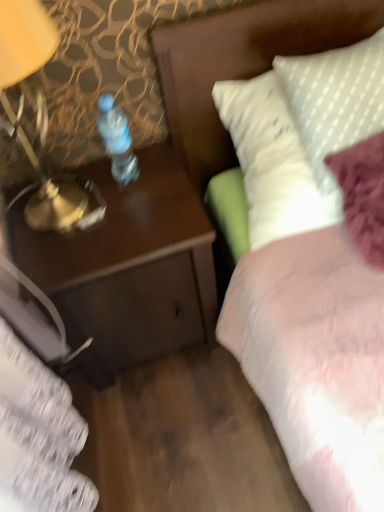
Where is `brown wood desk at left`? The image size is (384, 512). brown wood desk at left is located at coordinates (128, 267).

This screenshot has height=512, width=384. I want to click on white dotted pillow at upper right, so click(x=335, y=99).

This screenshot has width=384, height=512. What are the coordinates of `clear plastic bottle at center` in the screenshot? It's located at (117, 140).

This screenshot has height=512, width=384. I want to click on brown wood desk at left, so click(x=128, y=267).

Can you tell me how much white dotted pillow at upper right and clear plastic bottle at center differ in facing direction?

5.44 degrees.

Is point (364, 104) behind point (129, 175)?

No, (364, 104) is in front of (129, 175).

Can you confirm if white dotted pillow at upper right is shorter than clear plastic bottle at center?

Incorrect, the height of white dotted pillow at upper right does not fall short of that of clear plastic bottle at center.

Consider the image. Looking at their sizes, would you say white dotted pillow at upper right is wider or thinner than clear plastic bottle at center?

white dotted pillow at upper right is wider than clear plastic bottle at center.

Which object is more forward, clear plastic bottle at center or gold metallic lamp at left?

gold metallic lamp at left.

Can you confirm if clear plastic bottle at center is shorter than gold metallic lamp at left?

Correct, clear plastic bottle at center is not as tall as gold metallic lamp at left.

Is clear plastic bottle at center facing away from gold metallic lamp at left?

No, gold metallic lamp at left is not at the back of clear plastic bottle at center.

Can you confirm if clear plastic bottle at center is smaller than gold metallic lamp at left?

Indeed, clear plastic bottle at center has a smaller size compared to gold metallic lamp at left.

Based on the photo, from a real-world perspective, is white dotted fabric at upper right positioned under white dotted pillow at upper right based on gravity?

Yes, from a real-world perspective, white dotted fabric at upper right is beneath white dotted pillow at upper right.

In terms of size, does white dotted fabric at upper right appear bigger or smaller than white dotted pillow at upper right?

In the image, white dotted fabric at upper right appears to be larger than white dotted pillow at upper right.

Considering the sizes of objects white dotted fabric at upper right and white dotted pillow at upper right in the image provided, who is taller, white dotted fabric at upper right or white dotted pillow at upper right?

white dotted pillow at upper right is taller.

Which is correct: brown wood desk at left is inside clear plastic bottle at center, or outside of it?

The correct answer is: outside.

How different are the orientations of brown wood desk at left and clear plastic bottle at center in degrees?

The angle between the facing direction of brown wood desk at left and the facing direction of clear plastic bottle at center is 1.13 degrees.

Who is more distant, brown wood desk at left or clear plastic bottle at center?

Positioned behind is brown wood desk at left.

Considering the sizes of objects brown wood desk at left and clear plastic bottle at center in the image provided, who is bigger, brown wood desk at left or clear plastic bottle at center?

brown wood desk at left is bigger.

In the scene shown: How different are the orientations of gold metallic lamp at left and white dotted fabric at upper right in degrees?

gold metallic lamp at left and white dotted fabric at upper right are facing 1.82 degrees away from each other.

Is gold metallic lamp at left situated inside white dotted fabric at upper right or outside?

gold metallic lamp at left is not enclosed by white dotted fabric at upper right.

Which object is positioned more to the left, gold metallic lamp at left or white dotted fabric at upper right?

From the viewer's perspective, gold metallic lamp at left appears more on the left side.

Considering the sizes of gold metallic lamp at left and white dotted fabric at upper right in the image, is gold metallic lamp at left wider or thinner than white dotted fabric at upper right?

Considering their sizes, gold metallic lamp at left looks slimmer than white dotted fabric at upper right.

Can you see clear plastic bottle at center touching brown wood desk at left?

clear plastic bottle at center is not next to brown wood desk at left, and they're not touching.

Consider the image. Is the depth of clear plastic bottle at center greater than that of brown wood desk at left?

No, clear plastic bottle at center is in front of brown wood desk at left.

Which of these two, clear plastic bottle at center or brown wood desk at left, is smaller?

With smaller size is clear plastic bottle at center.

From the image's perspective, between clear plastic bottle at center and brown wood desk at left, who is located below?

brown wood desk at left, from the image's perspective.

Can you confirm if clear plastic bottle at center is shorter than white dotted fabric at upper right?

Indeed, clear plastic bottle at center has a lesser height compared to white dotted fabric at upper right.

Is point (110, 100) closer or farther from the camera than point (244, 65)?

Point (110, 100) appears to be closer to the viewer than point (244, 65).

Which object is more forward, clear plastic bottle at center or white dotted fabric at upper right?

white dotted fabric at upper right is closer to the camera.

This screenshot has width=384, height=512. What are the coordinates of `pillow in front of the clear plastic bottle at center` in the screenshot? It's located at (335, 99).

In order to click on bottle below the gold metallic lamp at left (from a real-world perspective) in this screenshot , I will do `click(117, 140)`.

Based on their spatial positions, is gold metallic lamp at left or clear plastic bottle at center further from brown wood desk at left?

clear plastic bottle at center is further to brown wood desk at left.

When comparing their distances from clear plastic bottle at center, does brown wood desk at left or white dotted fabric at upper right seem further?

white dotted fabric at upper right.

Looking at the image, which one is located further to white dotted pillow at upper right, white dotted fabric at upper right or gold metallic lamp at left?

gold metallic lamp at left.

Based on the photo, looking at the image, which one is located further to gold metallic lamp at left, white dotted fabric at upper right or brown wood desk at left?

Among the two, white dotted fabric at upper right is located further to gold metallic lamp at left.

Considering their positions, is clear plastic bottle at center positioned further to white dotted fabric at upper right than white dotted pillow at upper right?

The object further to white dotted fabric at upper right is clear plastic bottle at center.

From the image, which object appears to be farther from brown wood desk at left, white dotted fabric at upper right or gold metallic lamp at left?

white dotted fabric at upper right is positioned further to the anchor brown wood desk at left.

Based on the photo, based on their spatial positions, is white dotted fabric at upper right or clear plastic bottle at center further from gold metallic lamp at left?

white dotted fabric at upper right lies further to gold metallic lamp at left than the other object.

When comparing their distances from brown wood desk at left, does clear plastic bottle at center or white dotted fabric at upper right seem closer?

clear plastic bottle at center lies closer to brown wood desk at left than the other object.

Find the location of a particular element. The image size is (384, 512). headboard located between clear plastic bottle at center and white dotted pillow at upper right in the left-right direction is located at coordinates (241, 63).

Where is `headboard between brown wood desk at left and white dotted pillow at upper right from left to right`? headboard between brown wood desk at left and white dotted pillow at upper right from left to right is located at coordinates (241, 63).

Find the location of a particular element. The width and height of the screenshot is (384, 512). desk located between gold metallic lamp at left and white dotted fabric at upper right in the left-right direction is located at coordinates (128, 267).

Locate an element on the screen. bottle positioned between gold metallic lamp at left and brown wood desk at left from near to far is located at coordinates (117, 140).